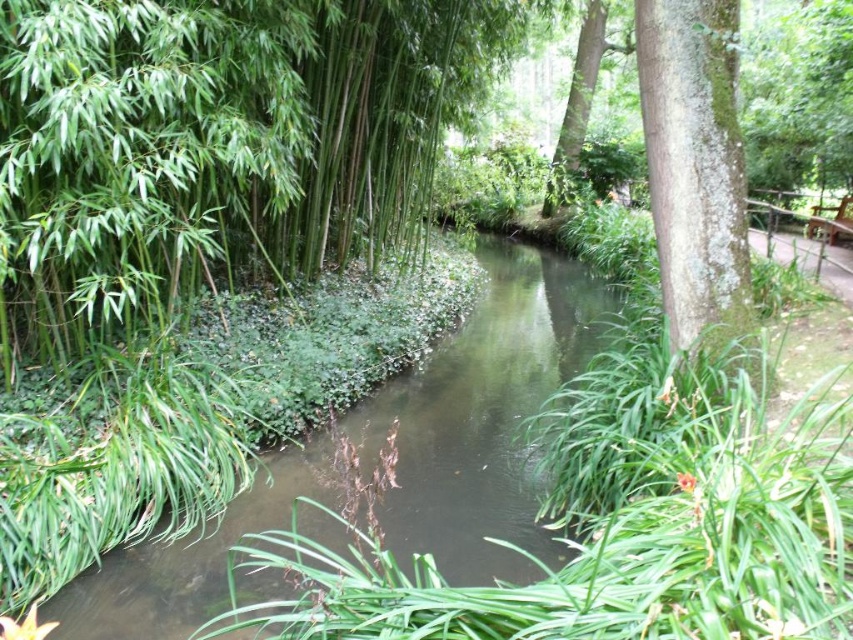
You are standing at the edge of the stream and want to place a small decorative rock exactly at the center of the green leafy stream at center. According to the coordinates provided, where should you place the rock?

You should place the rock at the coordinates point (x=483, y=417), which is the exact location of the green leafy stream at center.